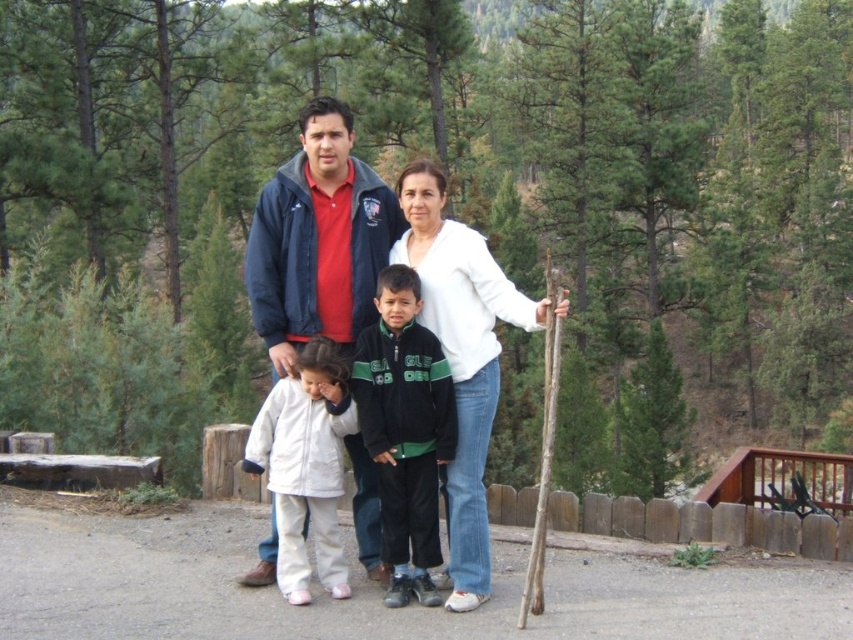
You are a hiker trying to locate the matte blue jacket at center in the forest scene. According to the coordinates given, where exactly would you find it?

The matte blue jacket at center is located at point coordinates of (451, 337).

You are a photographer trying to capture a clear shot of the white matte shirt at center and the white fleece jacket at lower left. Since both are white, you want to ensure you can distinguish them in the photo. According to the scene description, which one is closer to the camera?

The white matte shirt at center is in front of the white fleece jacket at lower left, so it is closer to the camera.

Based on the scene description, where is the white matte shirt at center located in the image?

The white matte shirt at center is located at point 0.561 on the x axis and 0.543 on the y axis.